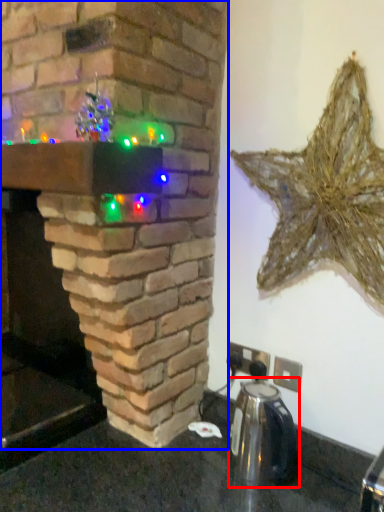
Question: Which of the following is the farthest to the observer, appliance (highlighted by a red box) or fireplace (highlighted by a blue box)?

Choices:
 (A) appliance
 (B) fireplace

Answer: (A)